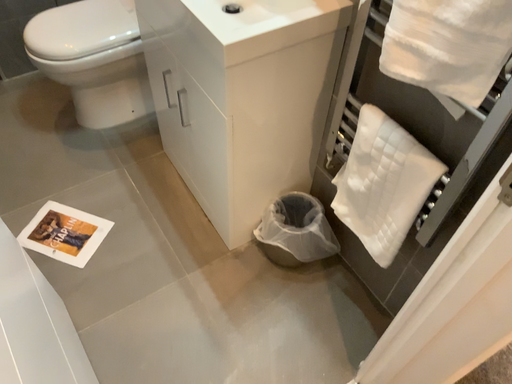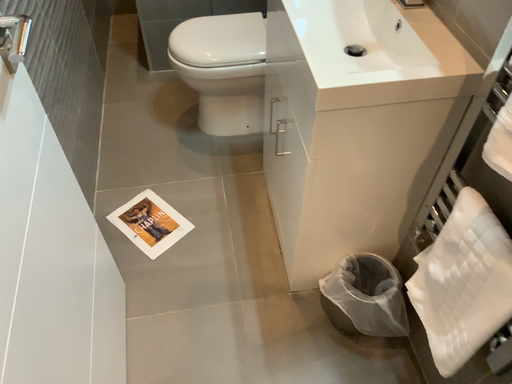
Question: Which way did the camera rotate in the video?

Choices:
 (A) rotated right
 (B) rotated left

Answer: (B)